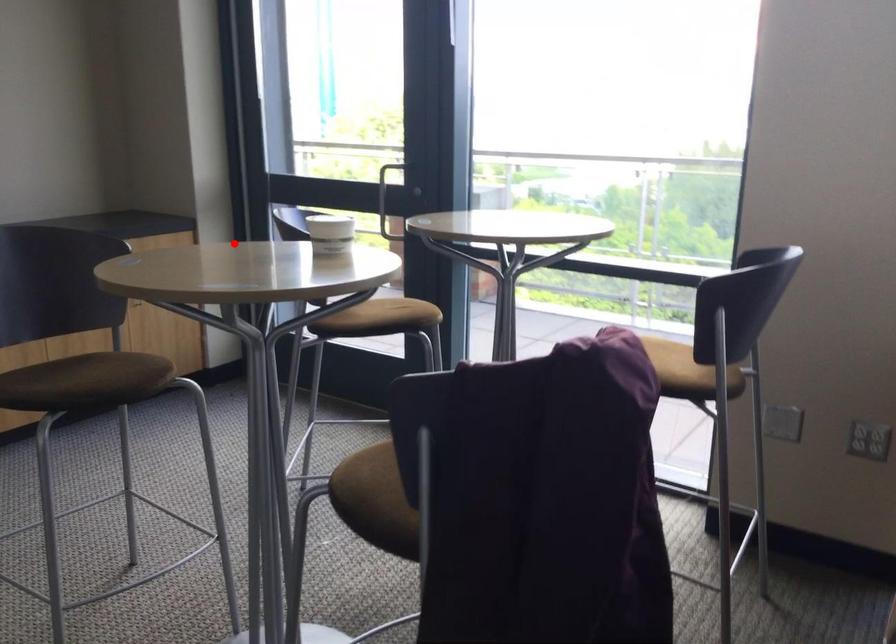
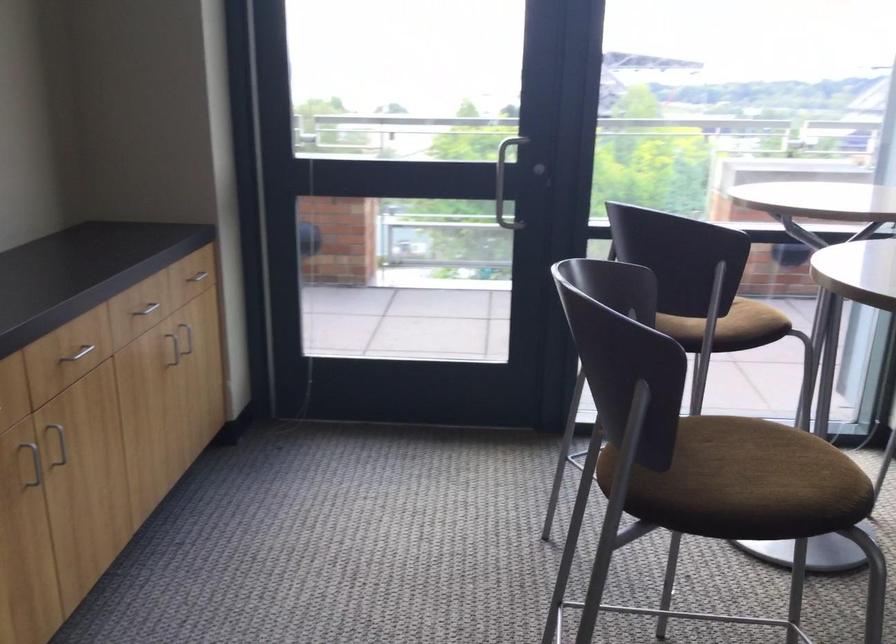
Where in the second image is the point corresponding to the highlighted location from the first image?

(194, 279)